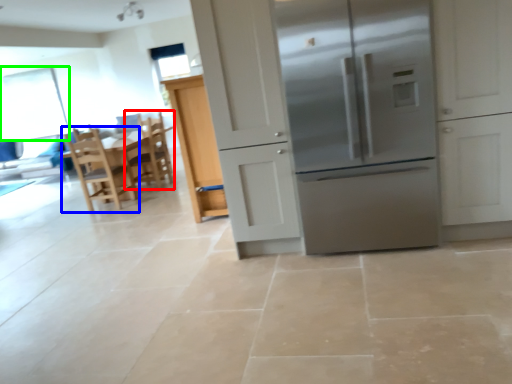
Question: Considering the real-world distances, which object is farthest from chair (highlighted by a red box)? chair (highlighted by a blue box) or window screen (highlighted by a green box)?

Choices:
 (A) chair
 (B) window screen

Answer: (B)